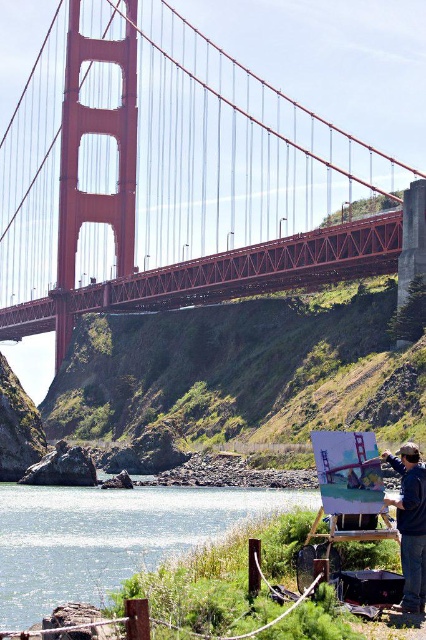
You are a tourist visiting the Golden Gate Bridge and want to take a photo that includes both the red painted steel suspension bridge at center and the dark blue fabric at lower right. Based on their positions, where should you position yourself to ensure both are visible in the frame?

To capture both the red painted steel suspension bridge at center and the dark blue fabric at lower right in your photo, position yourself at a lower viewpoint so that the bridge, which is above the dark blue fabric at lower right, can be seen alongside it in the frame.